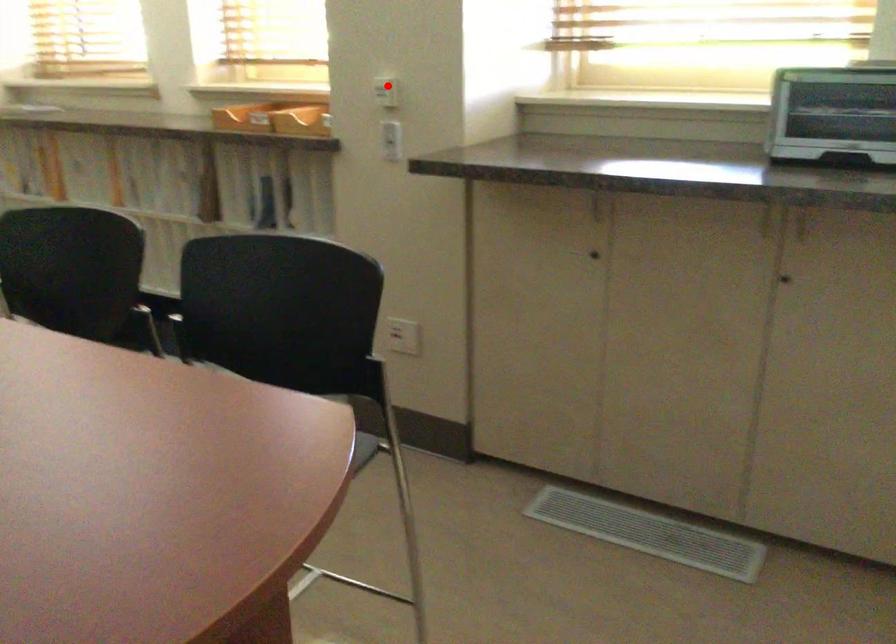
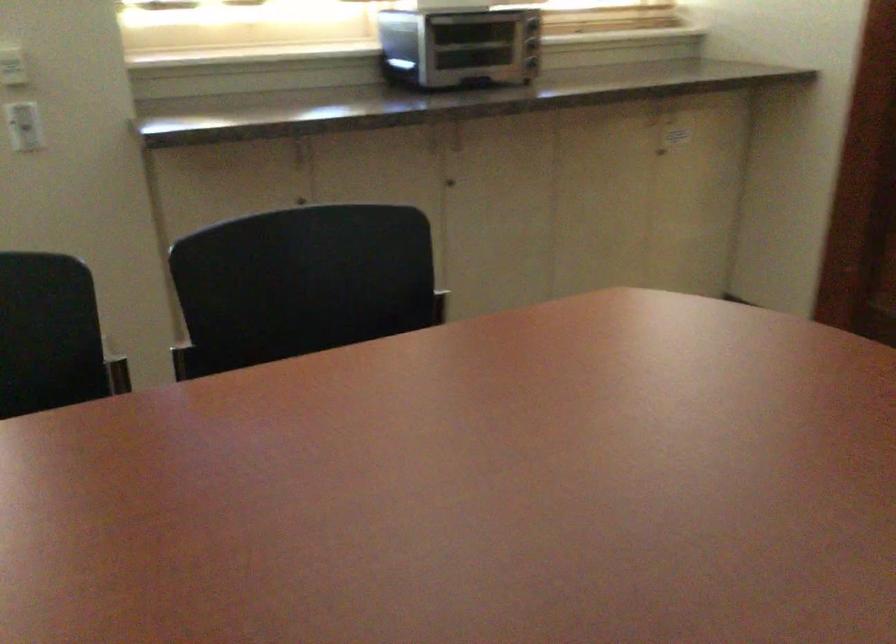
Question: A red point is marked in image1. In image2, is the corresponding 3D point closer to the camera or farther? Reply with the corresponding letter.

Choices:
 (A) The corresponding 3D point is closer.
 (B) The corresponding 3D point is farther.

Answer: (A)